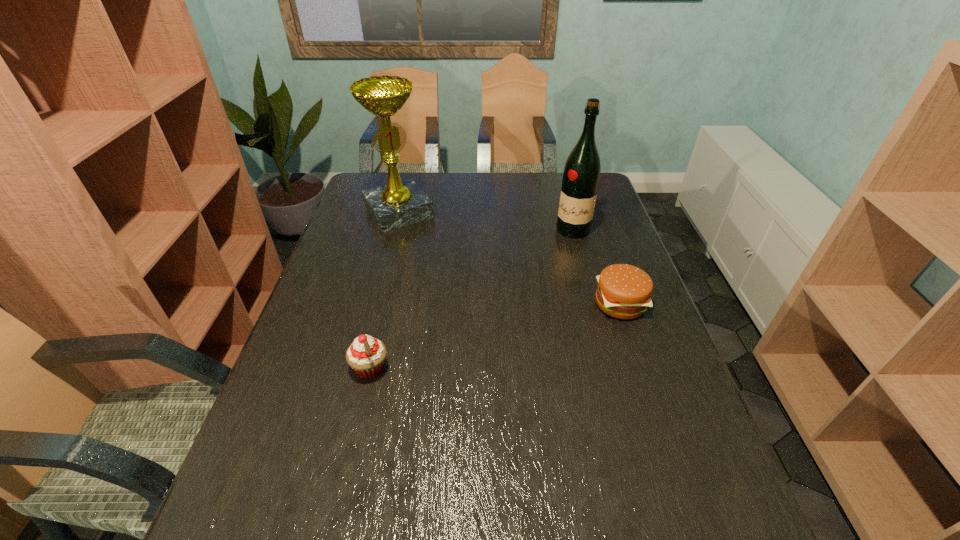
Where is `the second shortest object`? This screenshot has width=960, height=540. the second shortest object is located at coordinates pyautogui.click(x=366, y=355).

In order to click on cupcake in this screenshot , I will do `click(366, 355)`.

In order to click on hamburger in this screenshot , I will do point(624,291).

You are a GUI agent. You are given a task and a screenshot of the screen. Output one action in this format:
    pyautogui.click(x=<x>, y=<y>)
    Task: Click on the second nearest object
    This screenshot has width=960, height=540.
    Given the screenshot: What is the action you would take?
    pyautogui.click(x=624, y=291)

Identify the location of award. The height and width of the screenshot is (540, 960). (399, 203).

Locate an element on the screen. The image size is (960, 540). liquor is located at coordinates (581, 176).

Identify the location of free space located 0.120m on the right of the cupcake. (441, 368).

I want to click on vacant region located 0.130m on the left of the second nearest object, so 547,303.

This screenshot has height=540, width=960. Identify the location of vacant space located on the front-facing side of the award. (449, 276).

At what (x,y) coordinates should I click in order to perform the action: click on vacant space situated on the front-facing side of the award. Please return your answer as a coordinate pair (x, y). The height and width of the screenshot is (540, 960). Looking at the image, I should click on (436, 259).